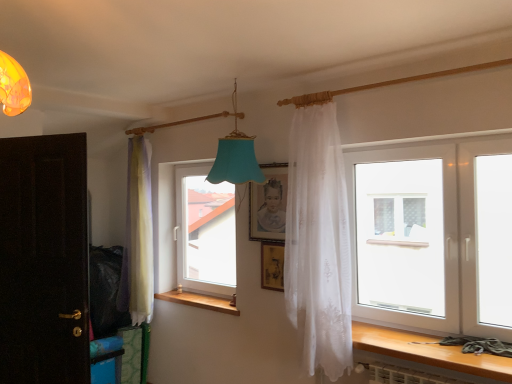
This screenshot has width=512, height=384. I want to click on vacant space situated above wooden table at lower right (from a real-world perspective), so click(x=412, y=339).